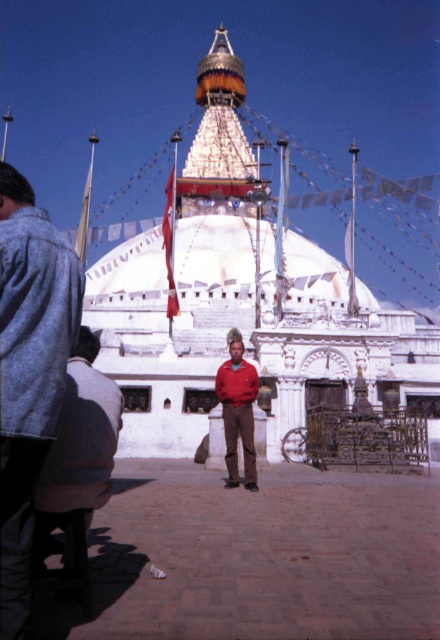
You are a photographer planning to take a photo of the stupa. You notice two people in the scene, the brushed denim jacket at lower left and the red matte jacket at center. To ensure both are in focus, you need to know which one is taller. Can you determine which person is taller?

The brushed denim jacket at lower left has a greater height compared to the red matte jacket at center, so the person wearing the brushed denim jacket at lower left is taller.

You are taking a photo of the stupa and notice two points marked in the image. The first point is at coordinate point (51, 280) and the second is at point (228, 449). Which point is closer to your camera lens?

Point (51, 280) is closer to the camera than point (228, 449).

You are standing in front of the stupa and want to determine which of the two points, point [51,458] or point [237,340], is nearer to you. Based on the image, which point is closer?

Point [51,458] is closer to the viewer than point [237,340].